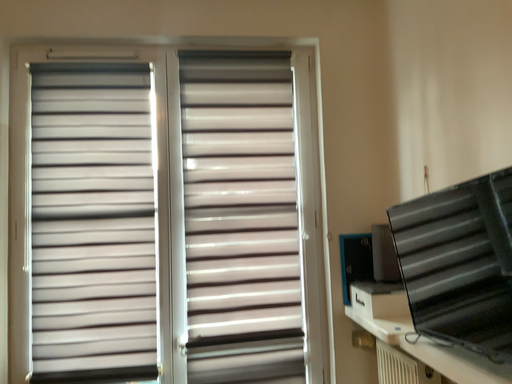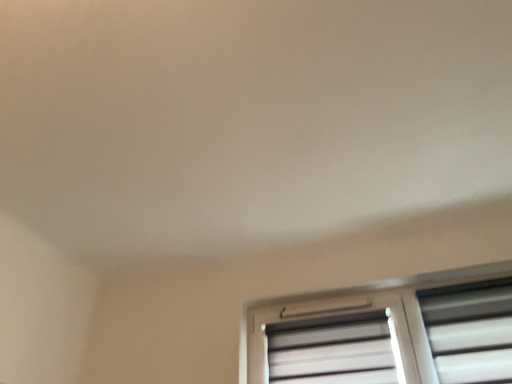
Question: Which way did the camera rotate in the video?

Choices:
 (A) rotated right
 (B) rotated left

Answer: (B)